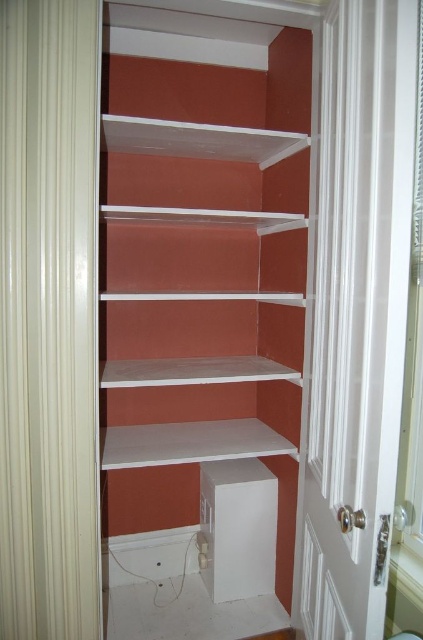
Does white matte shelves at center appear on the right side of white glossy door at center?

No, white matte shelves at center is not to the right of white glossy door at center.

You are a GUI agent. You are given a task and a screenshot of the screen. Output one action in this format:
    pyautogui.click(x=<x>, y=<y>)
    Task: Click on the white matte shelves at center
    The image size is (423, 640).
    Given the screenshot: What is the action you would take?
    pyautogui.click(x=200, y=317)

Can you confirm if white matte shelves at center is positioned below beige textured curtain at left?

Incorrect, white matte shelves at center is not positioned below beige textured curtain at left.

Can you confirm if white matte shelves at center is positioned to the right of beige textured curtain at left?

Indeed, white matte shelves at center is positioned on the right side of beige textured curtain at left.

Does point (208, 513) come in front of point (82, 305)?

That is False.

Locate an element on the screen. This screenshot has height=640, width=423. white matte shelves at center is located at coordinates (200, 317).

Is beige textured curtain at left to the left of white glossy door at center from the viewer's perspective?

Yes, beige textured curtain at left is to the left of white glossy door at center.

Who is higher up, beige textured curtain at left or white glossy door at center?

beige textured curtain at left is above.

Is point (76, 1) farther from viewer compared to point (357, 124)?

Yes, point (76, 1) is farther from viewer.

This screenshot has height=640, width=423. I want to click on beige textured curtain at left, so click(x=49, y=320).